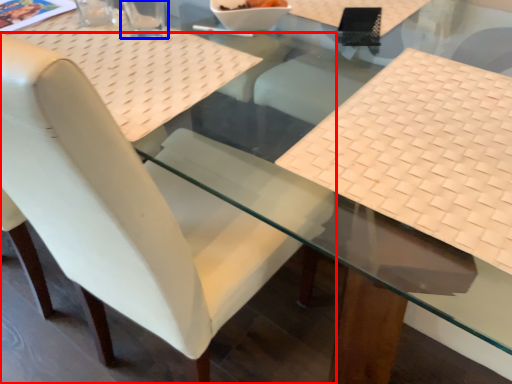
Question: Among these objects, which one is farthest to the camera, chair (highlighted by a red box) or clear (highlighted by a blue box)?

Choices:
 (A) chair
 (B) clear

Answer: (B)